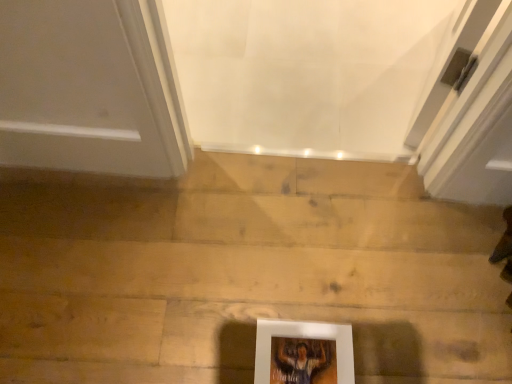
Question: Should I look upward or downward to see white matte picture frame at lower center?

Choices:
 (A) down
 (B) up

Answer: (A)